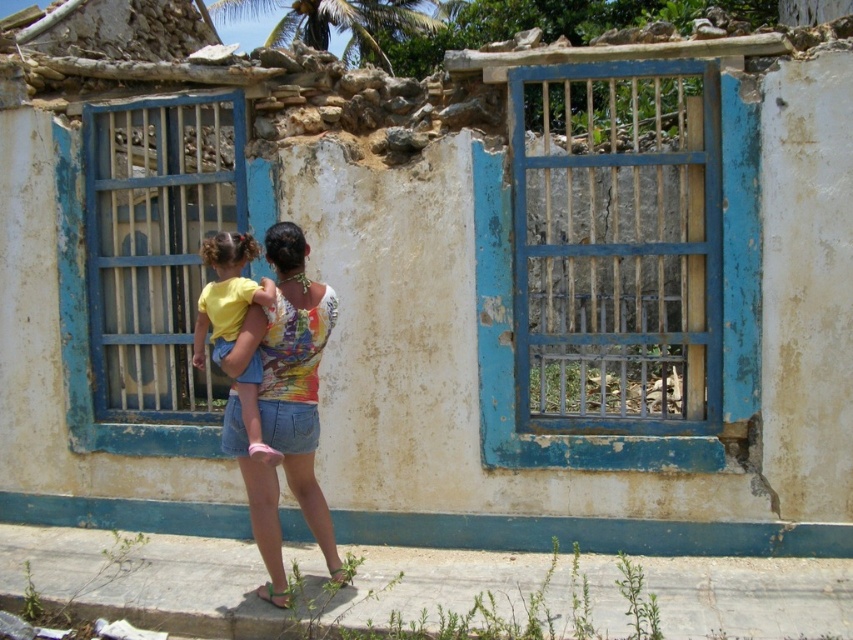
Is multicolored printed tank top at center to the right of yellow cotton shirt at center from the viewer's perspective?

Yes, multicolored printed tank top at center is to the right of yellow cotton shirt at center.

Between multicolored printed tank top at center and yellow cotton shirt at center, which one has less height?

Standing shorter between the two is yellow cotton shirt at center.

Who is more distant from viewer, (305, 248) or (235, 250)?

The point (305, 248) is behind.

Identify the location of multicolored printed tank top at center. The image size is (853, 640). (291, 372).